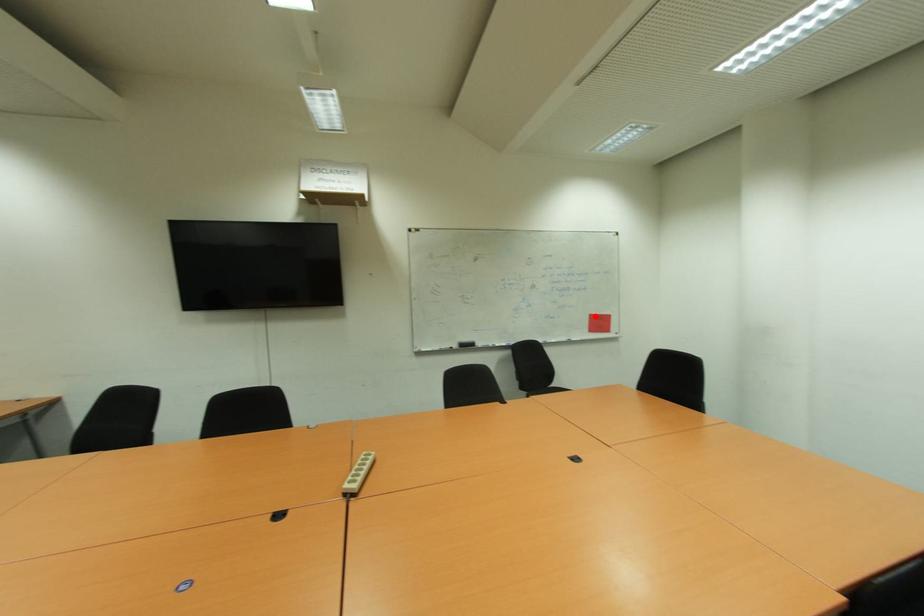
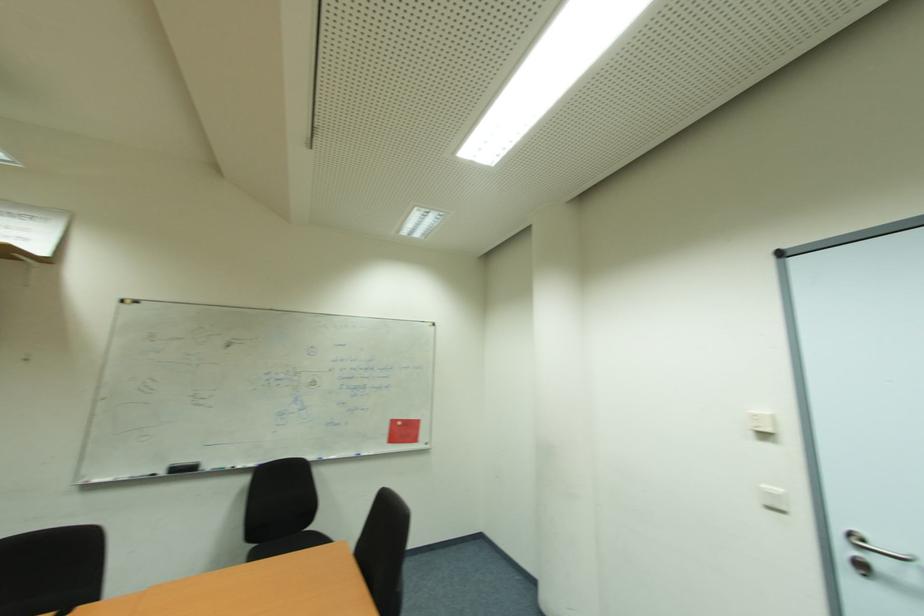
Locate, in the second image, the point that corresponds to the highlighted location in the first image.

(397, 423)